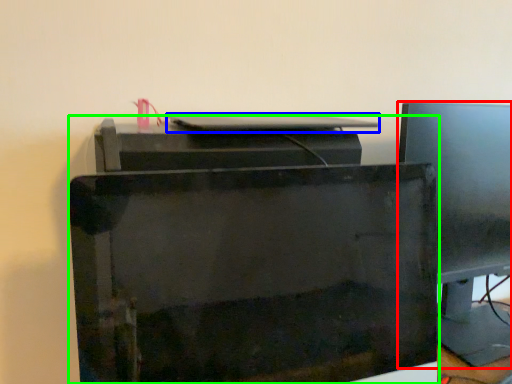
Question: Which object is positioned closest to computer monitor (highlighted by a red box)? Select from desktop (highlighted by a blue box) and printer (highlighted by a green box).

Choices:
 (A) desktop
 (B) printer

Answer: (A)